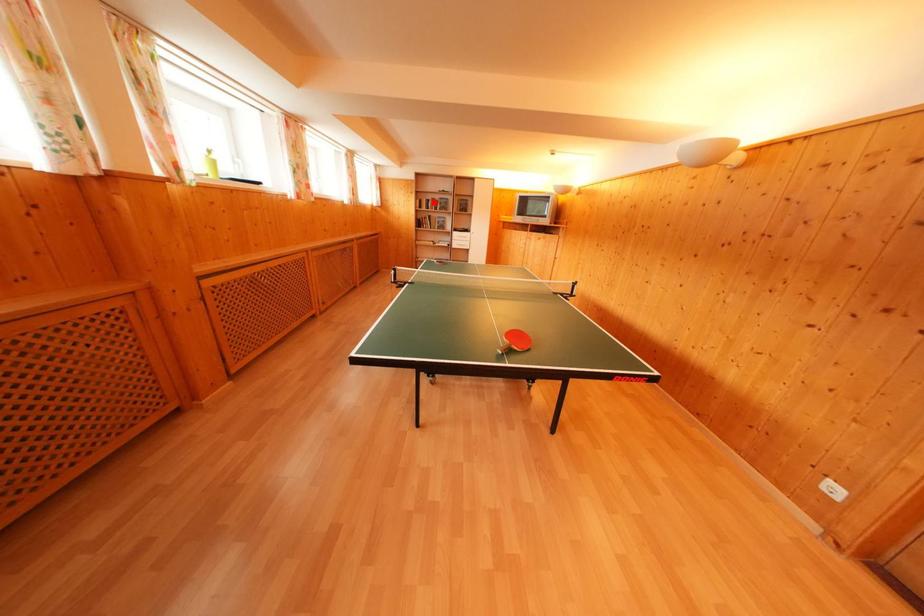
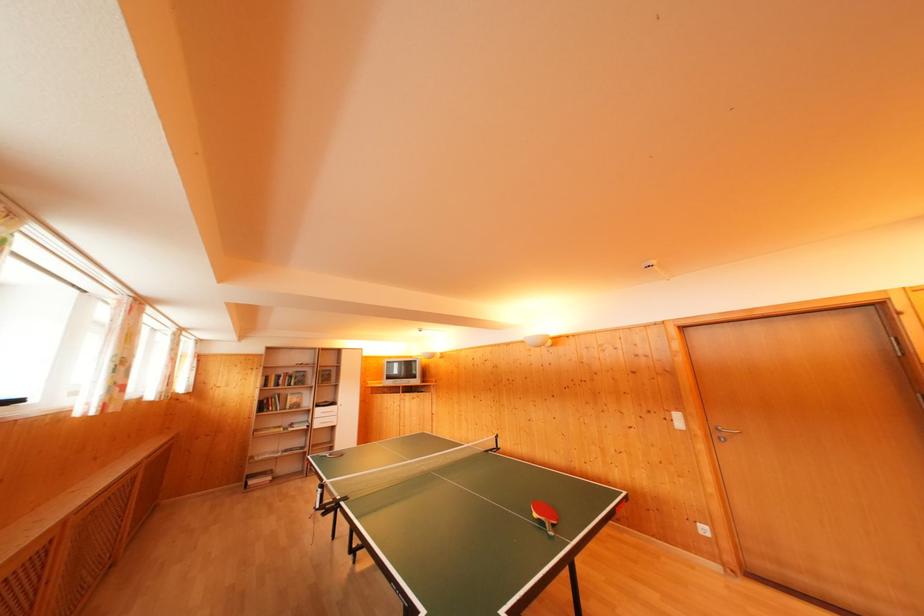
Question: A red point is marked in image1. In image2, is the corresponding 3D point closer to the camera or farther? Reply with the corresponding letter.

Choices:
 (A) The corresponding 3D point is closer.
 (B) The corresponding 3D point is farther.

Answer: (B)